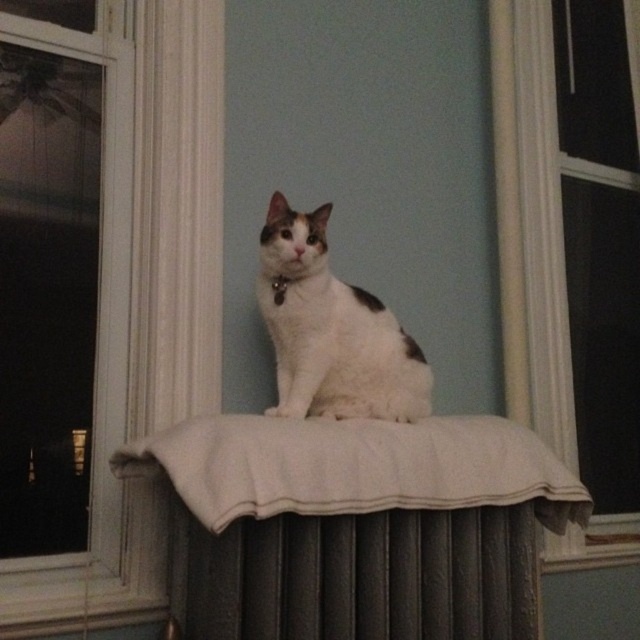
Is white fur cat at center in front of black fabric neckband at center?

Yes, it is in front of black fabric neckband at center.

Does white fur cat at center have a lesser height compared to black fabric neckband at center?

In fact, white fur cat at center may be taller than black fabric neckband at center.

This screenshot has width=640, height=640. In order to click on white fur cat at center in this screenshot , I will do `click(332, 332)`.

Where is `dark gray metal radiator at center`? The height and width of the screenshot is (640, 640). dark gray metal radiator at center is located at coordinates (356, 576).

Between dark gray metal radiator at center and black fabric neckband at center, which one is positioned lower?

dark gray metal radiator at center

Image resolution: width=640 pixels, height=640 pixels. In order to click on dark gray metal radiator at center in this screenshot , I will do `click(356, 576)`.

Is point (252, 577) farther from viewer compared to point (280, 300)?

No, (252, 577) is closer to viewer.

Where is `dark gray metal radiator at center`? The height and width of the screenshot is (640, 640). dark gray metal radiator at center is located at coordinates point(356,576).